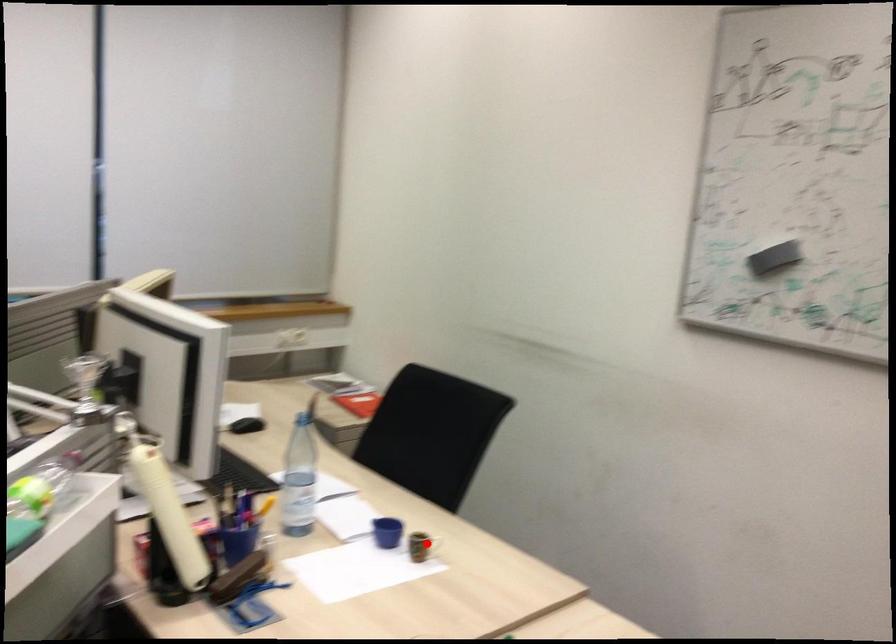
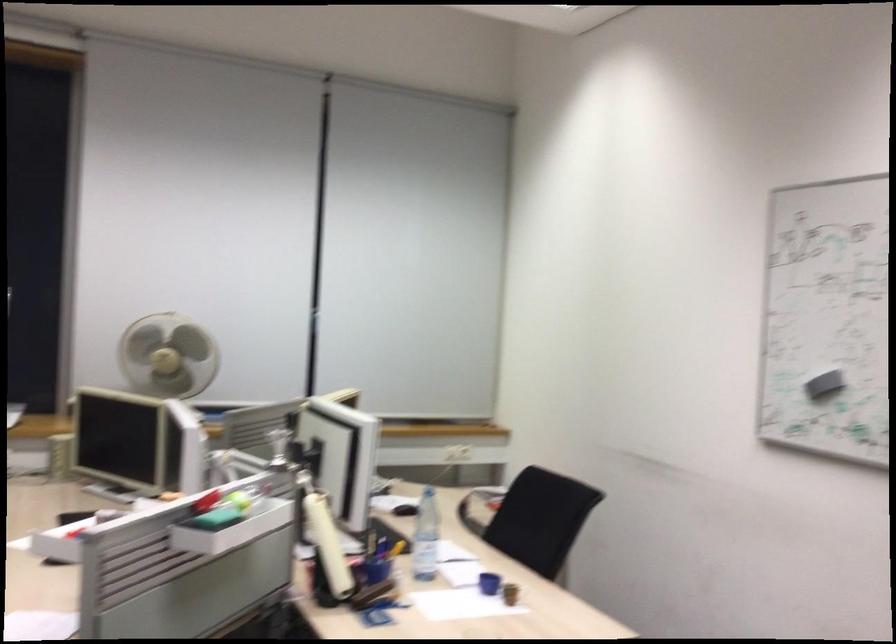
Question: I am providing you with two images of the same scene from different viewpoints. Image1 has a red point marked. In image2, the corresponding 3D location appears at what relative position? Reply with the corresponding letter.

Choices:
 (A) Closer
 (B) Farther

Answer: (B)